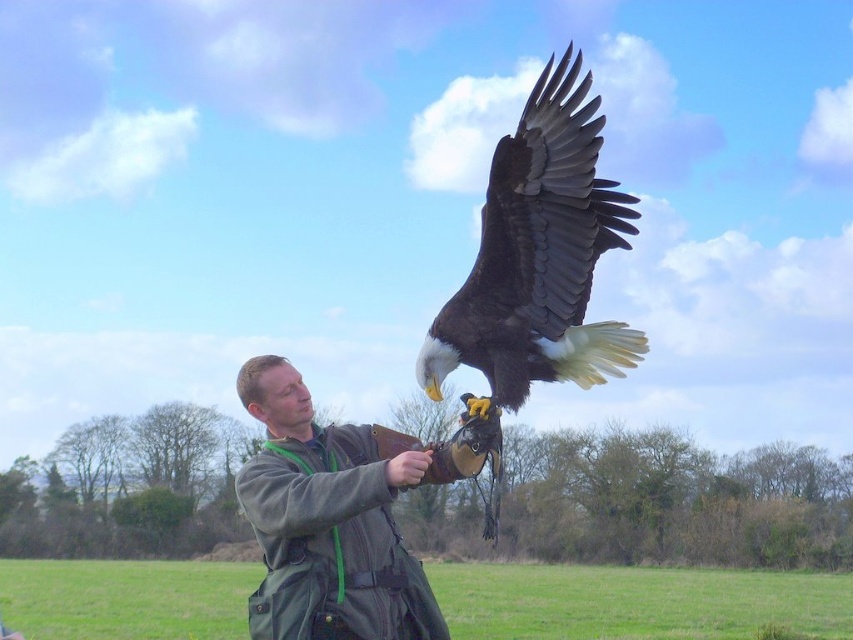
Question: Does green fabric bag at center have a smaller size compared to white-feathered bald eagle at upper center?

Choices:
 (A) no
 (B) yes

Answer: (B)

Question: Which point is farther to the camera?

Choices:
 (A) white-feathered bald eagle at upper center
 (B) green fabric bag at center
 (C) green fabric jacket at center
 (D) matte brown glove at center

Answer: (B)

Question: Is green fabric bag at center behind fuzzy gray arm at center?

Choices:
 (A) no
 (B) yes

Answer: (B)

Question: Is white-feathered bald eagle at upper center to the right of fuzzy gray arm at center from the viewer's perspective?

Choices:
 (A) yes
 (B) no

Answer: (A)

Question: Among these objects, which one is nearest to the camera?

Choices:
 (A) white-feathered bald eagle at upper center
 (B) green fabric jacket at center

Answer: (A)

Question: Which object is farther from the camera taking this photo?

Choices:
 (A) fuzzy gray arm at center
 (B) green fabric bag at center

Answer: (B)